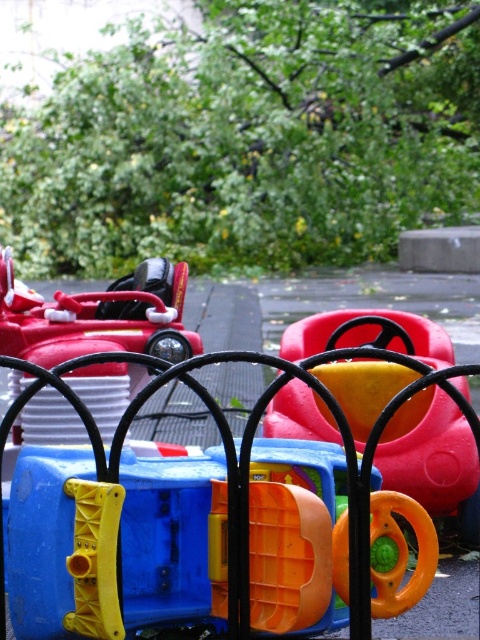
The width and height of the screenshot is (480, 640). In order to click on rubberized yellow steering wheel at center in this screenshot , I will do `click(432, 460)`.

Who is shorter, blue plastic steering wheel at center or rubberized yellow steering wheel at center?

With less height is blue plastic steering wheel at center.

Does blue plastic steering wheel at center have a smaller size compared to rubberized yellow steering wheel at center?

No.

The width and height of the screenshot is (480, 640). What do you see at coordinates (192, 529) in the screenshot? I see `blue plastic steering wheel at center` at bounding box center [192, 529].

The width and height of the screenshot is (480, 640). What are the coordinates of `blue plastic steering wheel at center` in the screenshot? It's located at (192, 529).

Does blue plastic steering wheel at center have a greater width compared to shiny red car at center?

Yes.

The height and width of the screenshot is (640, 480). What do you see at coordinates (192, 529) in the screenshot?
I see `blue plastic steering wheel at center` at bounding box center [192, 529].

You are a GUI agent. You are given a task and a screenshot of the screen. Output one action in this format:
    pyautogui.click(x=<x>, y=<y>)
    Task: Click on the blue plastic steering wheel at center
    This screenshot has height=640, width=480.
    Given the screenshot: What is the action you would take?
    pyautogui.click(x=192, y=529)